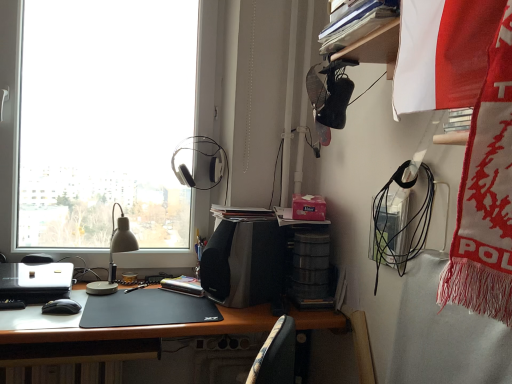
Measure the distance between point (44,262) and camera.

The depth of point (44,262) is 1.57 meters.

Based on the photo, what is the approximate width of black plastic chair at lower left?

It is 2.46 inches.

Measure the distance between transparent glass window at upper left and camera.

1.58 meters.

What do you see at coordinates (205, 156) in the screenshot?
I see `satin black headphones at upper center` at bounding box center [205, 156].

In order to face hardcover book at center, should I rotate leftwards or rightwards?

You should look left and rotate roughly 1.150 degrees.

At what (x,y) coordinates should I click in order to perform the action: click on black plastic chair at lower left. Please return your answer as a coordinate pair (x, y). This screenshot has height=384, width=512. Looking at the image, I should click on (37, 258).

Where is `book that is above the black matte mouse at lower left (from a real-world perspective)`? Image resolution: width=512 pixels, height=384 pixels. book that is above the black matte mouse at lower left (from a real-world perspective) is located at coordinates (241, 213).

From the image's perspective, which one is positioned higher, black matte mouse at lower left or hardcover book at center?

hardcover book at center.

From a real-world perspective, which object stands above the other?

From a 3D spatial view, hardcover book at center is above.

Is black matte mouse at lower left with hardcover book at center?

No, black matte mouse at lower left is not with hardcover book at center.

From the image's perspective, between black matte desk at center and black plastic chair at lower left, which one is located above?

black plastic chair at lower left, from the image's perspective.

From a real-world perspective, is black matte desk at center over black plastic chair at lower left?

No, from a real-world perspective, black matte desk at center is not on top of black plastic chair at lower left.

Between black matte desk at center and black plastic chair at lower left, which one has less height?

black plastic chair at lower left.

Identify the location of chair that is above the black matte desk at center (from the image's perspective). (37, 258).

Considering the sizes of transparent glass window at upper left and black matte desk at center in the image, is transparent glass window at upper left taller or shorter than black matte desk at center?

Considering their sizes, transparent glass window at upper left has more height than black matte desk at center.

From the image's perspective, would you say transparent glass window at upper left is positioned over black matte desk at center?

Yes, from the image's perspective, transparent glass window at upper left is over black matte desk at center.

Is point (20, 120) more distant than point (132, 334)?

That is True.

Is the surface of transparent glass window at upper left in direct contact with black matte desk at center?

No, transparent glass window at upper left is not making contact with black matte desk at center.

Which of these two, hardcover book at center or black plastic chair at lower left, is smaller?

black plastic chair at lower left.

From the image's perspective, between hardcover book at center and black plastic chair at lower left, which one is located above?

hardcover book at center, from the image's perspective.

In the scene shown: Which is more to the right, hardcover book at center or black plastic chair at lower left?

hardcover book at center.

Locate an element on the screen. The height and width of the screenshot is (384, 512). book above the black plastic chair at lower left (from a real-world perspective) is located at coordinates (241, 213).

Is black matte mouse at lower left closer to the viewer compared to black matte speaker at center?

Yes.

From a real-world perspective, is black matte mouse at lower left above or below black matte speaker at center?

From a real-world perspective, black matte mouse at lower left is physically below black matte speaker at center.

Is black matte mouse at lower left at the left side of black matte speaker at center?

Yes.

At what (x,y) coordinates should I click in order to perform the action: click on loudspeaker behind the black matte mouse at lower left. Please return your answer as a coordinate pair (x, y). Image resolution: width=512 pixels, height=384 pixels. Looking at the image, I should click on (245, 263).

From the image's perspective, which one is positioned lower, velvet-like fabric chair at lower center or black matte speaker at center?

From the image's view, velvet-like fabric chair at lower center is below.

Which of these two, velvet-like fabric chair at lower center or black matte speaker at center, is smaller?

With smaller size is velvet-like fabric chair at lower center.

From the picture: Which is more to the left, velvet-like fabric chair at lower center or black matte speaker at center?

black matte speaker at center.

Which object is more forward, velvet-like fabric chair at lower center or black matte speaker at center?

black matte speaker at center is more forward.

Is there a large distance between transparent glass window at upper left and hardcover book at center?

No, transparent glass window at upper left is not far from hardcover book at center.

In the image, is transparent glass window at upper left on the left side or the right side of hardcover book at center?

Clearly, transparent glass window at upper left is on the left of hardcover book at center in the image.

In the scene shown: From a real-world perspective, between transparent glass window at upper left and hardcover book at center, who is vertically higher?

transparent glass window at upper left.

At what (x,y) coordinates should I click in order to perform the action: click on mouse below the hardcover book at center (from a real-world perspective). Please return your answer as a coordinate pair (x, y). Looking at the image, I should click on pos(61,307).

At what (x,y) coordinates should I click in order to perform the action: click on chair above the black matte desk at center (from a real-world perspective). Please return your answer as a coordinate pair (x, y). The width and height of the screenshot is (512, 384). Looking at the image, I should click on (37, 258).

Looking at the image, which one is located further to black matte mouse at lower left, black matte speaker at center or silver metallic laptop at left?

Among the two, black matte speaker at center is located further to black matte mouse at lower left.

Which object lies further to the anchor point transparent glass window at upper left, hardcover book at center or satin black headphones at upper center?

hardcover book at center lies further to transparent glass window at upper left than the other object.

Based on their spatial positions, is black matte desk at center or black matte speaker at center closer to silver metallic laptop at left?

Based on the image, black matte desk at center appears to be nearer to silver metallic laptop at left.

In the scene shown: From the image, which object appears to be nearer to hardcover book at center, transparent glass window at upper left or velvet-like fabric chair at lower center?

transparent glass window at upper left is positioned closer to the anchor hardcover book at center.

Based on their spatial positions, is silver metallic laptop at left or hardcover book at center further from black matte desk at center?

hardcover book at center is further to black matte desk at center.

Which object lies further to the anchor point silver metallic laptop at left, black matte mouse at lower left or velvet-like fabric chair at lower center?

velvet-like fabric chair at lower center.

From the image, which object appears to be nearer to satin black headphones at upper center, black matte speaker at center or silver metallic laptop at left?

Among the two, black matte speaker at center is located nearer to satin black headphones at upper center.

In the scene shown: Estimate the real-world distances between objects in this image. Which object is closer to velvet-like fabric chair at lower center, hardcover book at center or satin black headphones at upper center?

hardcover book at center lies closer to velvet-like fabric chair at lower center than the other object.

Locate an element on the screen. window located between black plastic chair at lower left and black matte speaker at center in the left-right direction is located at coordinates (19, 141).

Find the location of `window between silver metallic laptop at left and hardcover book at center`. window between silver metallic laptop at left and hardcover book at center is located at coordinates (19, 141).

This screenshot has width=512, height=384. I want to click on chair between silver metallic laptop at left and black matte speaker at center from left to right, so click(x=37, y=258).

At what (x,y) coordinates should I click in order to perform the action: click on laptop between black matte desk at center and satin black headphones at upper center from front to back. Please return your answer as a coordinate pair (x, y). Image resolution: width=512 pixels, height=384 pixels. Looking at the image, I should click on (35, 281).